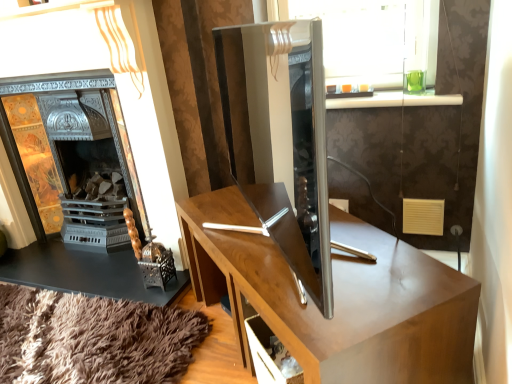
Find the location of a particular element. This screenshot has width=512, height=384. wooden desk at center is located at coordinates 337,298.

Describe the element at coordinates (337, 298) in the screenshot. I see `wooden desk at center` at that location.

Describe the element at coordinates (82, 159) in the screenshot. This screenshot has width=512, height=384. I see `metallic silver fireplace at left` at that location.

This screenshot has width=512, height=384. What are the coordinates of `metallic silver fireplace at left` in the screenshot? It's located at (82, 159).

Locate an element on the screen. wooden desk at center is located at coordinates (337, 298).

Considering the relative positions of wooden desk at center and metallic silver fireplace at left in the image provided, is wooden desk at center to the left or to the right of metallic silver fireplace at left?

wooden desk at center is to the right of metallic silver fireplace at left.

Is wooden desk at center in front of or behind metallic silver fireplace at left in the image?

Visually, wooden desk at center is located in front of metallic silver fireplace at left.

Is point (261, 262) closer or farther from the camera than point (74, 105)?

Point (261, 262) appears to be closer to the viewer than point (74, 105).

From the image's perspective, does wooden desk at center appear higher than metallic silver fireplace at left?

No, from the image's perspective, wooden desk at center is not above metallic silver fireplace at left.

Looking at this image, from a real-world perspective, between wooden desk at center and metallic silver fireplace at left, who is vertically lower?

wooden desk at center, from a real-world perspective.

Can you confirm if wooden desk at center is thinner than metallic silver fireplace at left?

Incorrect, the width of wooden desk at center is not less than that of metallic silver fireplace at left.

Considering the sizes of wooden desk at center and metallic silver fireplace at left in the image, is wooden desk at center taller or shorter than metallic silver fireplace at left?

In the image, wooden desk at center appears to be shorter than metallic silver fireplace at left.

Does wooden desk at center have a larger size compared to metallic silver fireplace at left?

Incorrect, wooden desk at center is not larger than metallic silver fireplace at left.

Would you say wooden desk at center contains metallic silver fireplace at left?

No, metallic silver fireplace at left is not inside wooden desk at center.

Is wooden desk at center far away from metallic silver fireplace at left?

No, wooden desk at center is not far from metallic silver fireplace at left.

Based on the photo, is wooden desk at center facing towards metallic silver fireplace at left?

No.

Can you tell me how much wooden desk at center and metallic silver fireplace at left differ in facing direction?

41.6 degrees separate the facing orientations of wooden desk at center and metallic silver fireplace at left.

This screenshot has height=384, width=512. I want to click on fireplace behind the wooden desk at center, so click(x=82, y=159).

Is metallic silver fireplace at left to the left or to the right of wooden desk at center in the image?

In the image, metallic silver fireplace at left appears on the left side of wooden desk at center.

Which is behind, metallic silver fireplace at left or wooden desk at center?

metallic silver fireplace at left is further away from the camera.

Which is in front, point (89, 148) or point (437, 324)?

Point (437, 324)

From the image's perspective, is metallic silver fireplace at left located above or below wooden desk at center?

Clearly, from the image's perspective, metallic silver fireplace at left is above wooden desk at center.

From a real-world perspective, which object rests below the other?

wooden desk at center is physically lower.

Which of these two, metallic silver fireplace at left or wooden desk at center, is thinner?

metallic silver fireplace at left is thinner.

Can you confirm if metallic silver fireplace at left is taller than wooden desk at center?

Yes, metallic silver fireplace at left is taller than wooden desk at center.

Considering the relative sizes of metallic silver fireplace at left and wooden desk at center in the image provided, is metallic silver fireplace at left smaller than wooden desk at center?

No.

Is wooden desk at center a part of metallic silver fireplace at left?

No.

Are metallic silver fireplace at left and wooden desk at center making contact?

metallic silver fireplace at left and wooden desk at center are not in contact.

Is metallic silver fireplace at left facing away from wooden desk at center?

No, metallic silver fireplace at left is not facing away from wooden desk at center.

The width and height of the screenshot is (512, 384). In order to click on fireplace behind the wooden desk at center in this screenshot , I will do `click(82, 159)`.

I want to click on fireplace on the left of wooden desk at center, so click(82, 159).

Identify the location of fireplace located behind the wooden desk at center. pos(82,159).